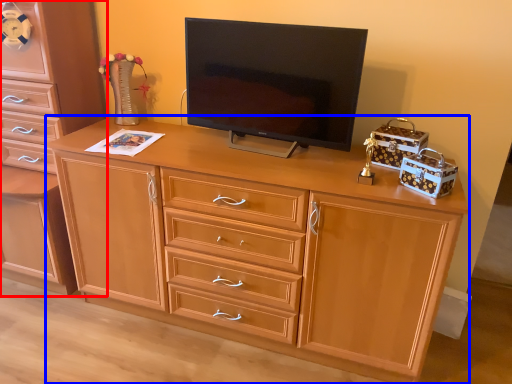
Question: Which object appears farthest to the camera in this image, chest of drawers (highlighted by a red box) or desk (highlighted by a blue box)?

Choices:
 (A) chest of drawers
 (B) desk

Answer: (A)